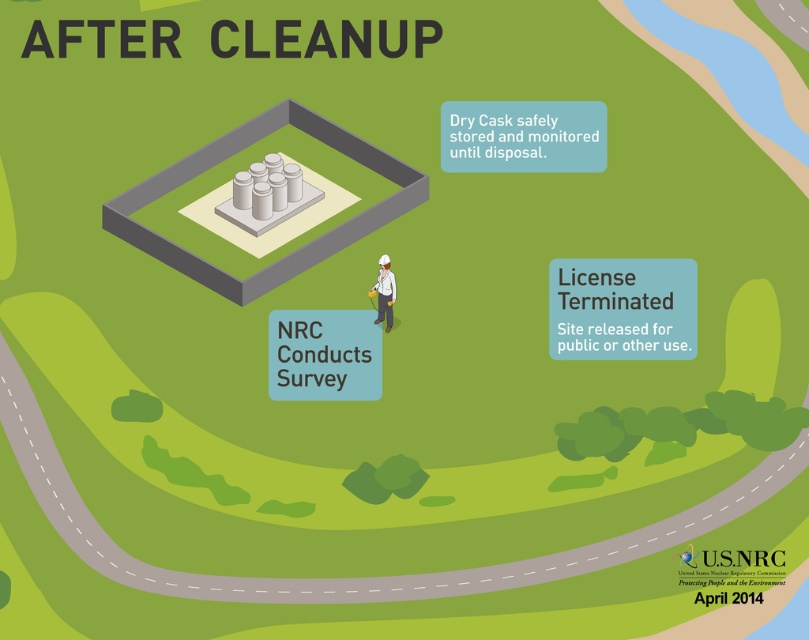
You are an inspector looking at the infographic titled AFTER CLEANUP. You see the matte gray cylinders at center and the white hard hat at center. Which object is located to the left of the other?

The matte gray cylinders at center are positioned to the left of the white hard hat at center.